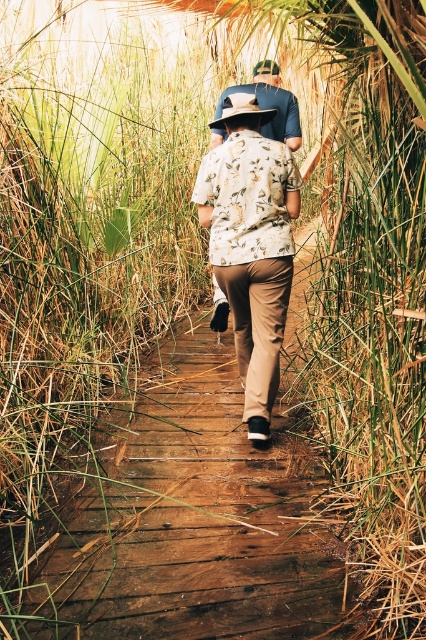
Question: Which of the following is the closest to the observer?

Choices:
 (A) [275, 186]
 (B) [253, 88]

Answer: (A)

Question: Is white floral shirt at center below matte blue shirt at center?

Choices:
 (A) no
 (B) yes

Answer: (B)

Question: Observing the image, what is the correct spatial positioning of white floral shirt at center in reference to matte blue shirt at center?

Choices:
 (A) above
 (B) below

Answer: (B)

Question: Does white floral shirt at center appear on the left side of matte blue shirt at center?

Choices:
 (A) yes
 (B) no

Answer: (A)